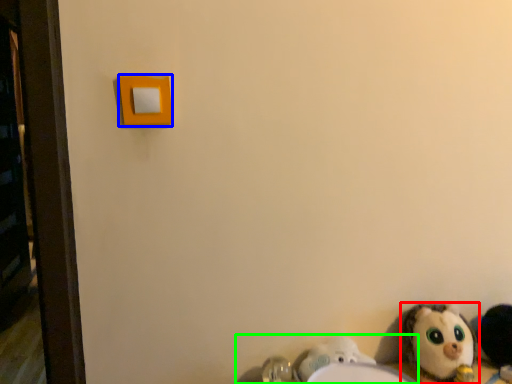
Question: Estimate the real-world distances between objects in this image. Which object is closer to toy (highlighted by a red box), light switch (highlighted by a blue box) or sink (highlighted by a green box)?

Choices:
 (A) light switch
 (B) sink

Answer: (B)